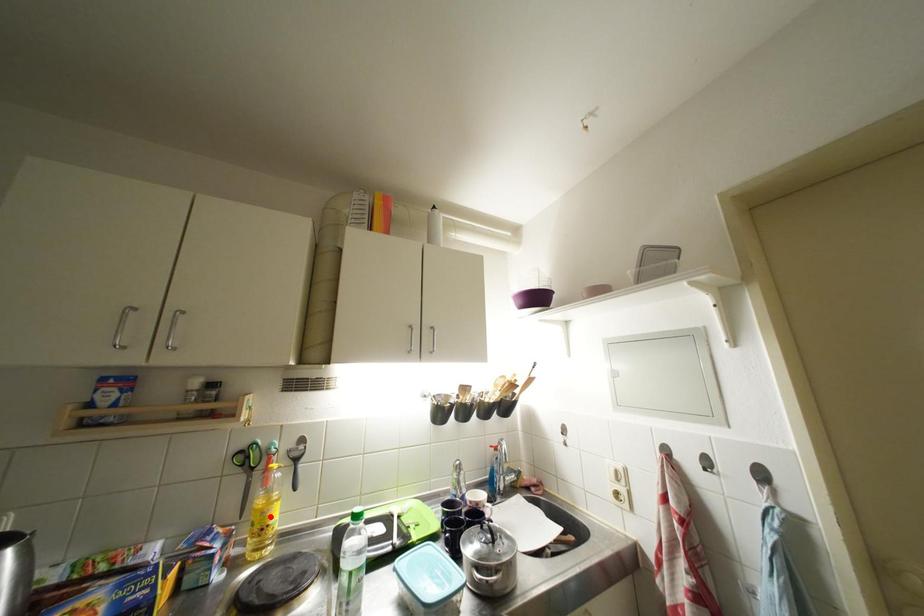
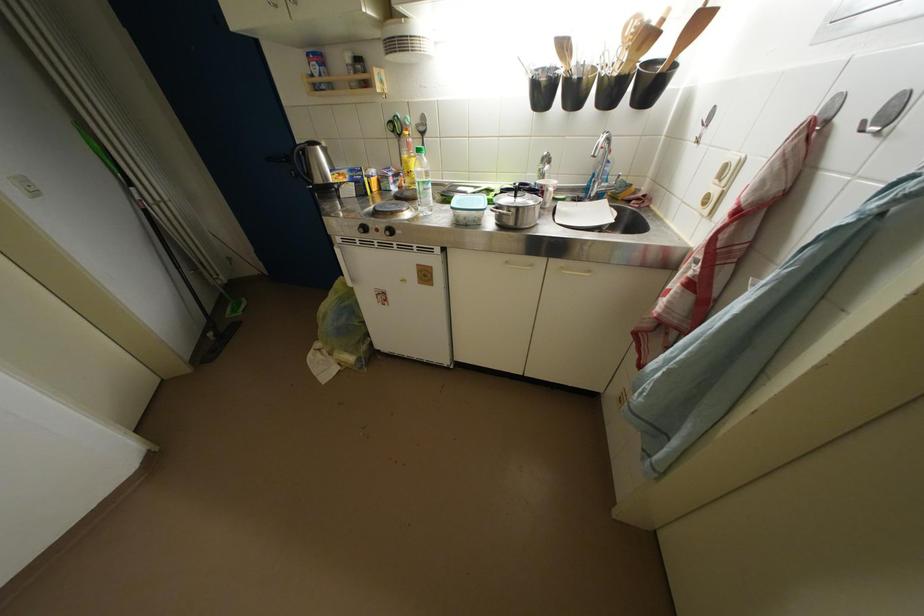
Where in the second image is the point corresponding to the highlighted location from the first image?

(412, 167)